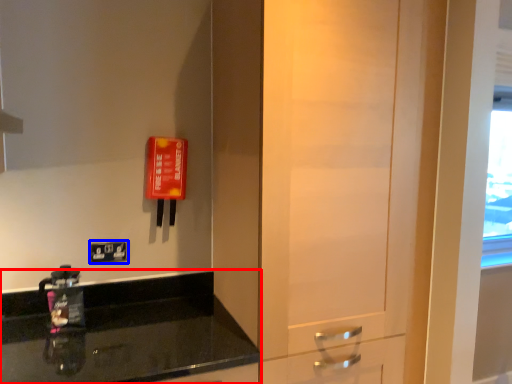
Question: Which of the following is the farthest to the observer, countertop (highlighted by a red box) or light switch (highlighted by a blue box)?

Choices:
 (A) countertop
 (B) light switch

Answer: (B)